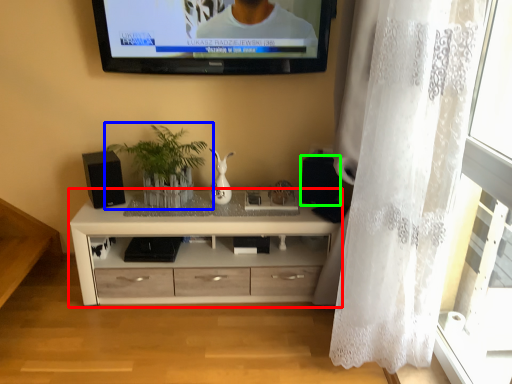
Question: Estimate the real-world distances between objects in this image. Which object is closer to chest of drawers (highlighted by a red box), houseplant (highlighted by a blue box) or speaker (highlighted by a green box)?

Choices:
 (A) houseplant
 (B) speaker

Answer: (A)